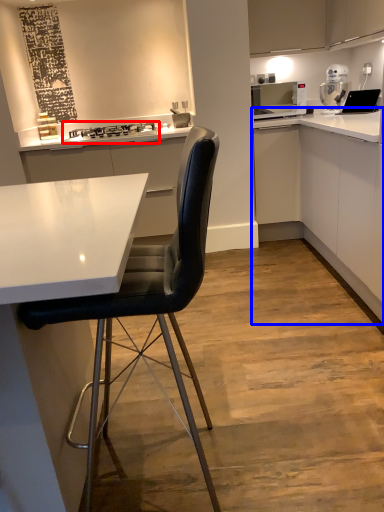
Question: Which object is closer to the camera taking this photo, stove (highlighted by a red box) or cabinetry (highlighted by a blue box)?

Choices:
 (A) stove
 (B) cabinetry

Answer: (B)